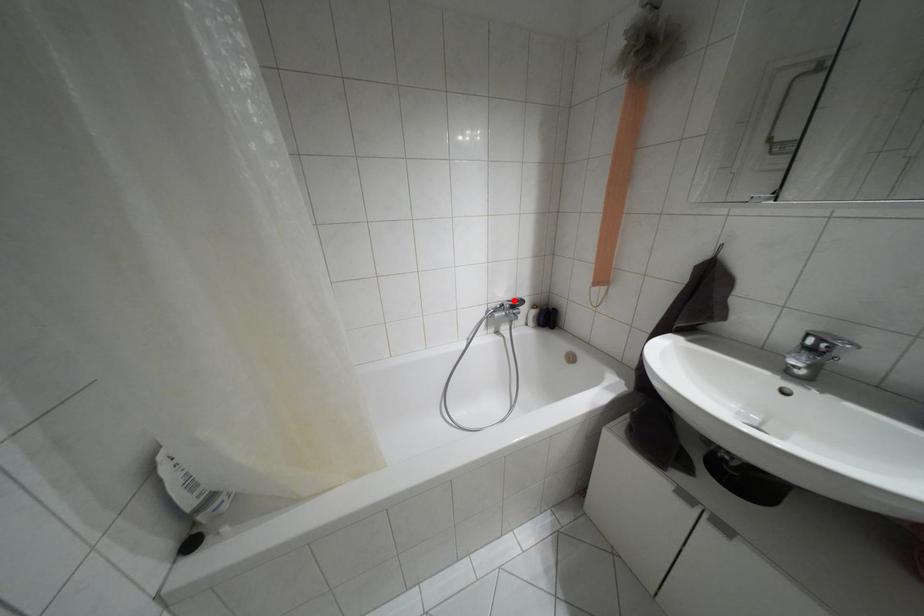
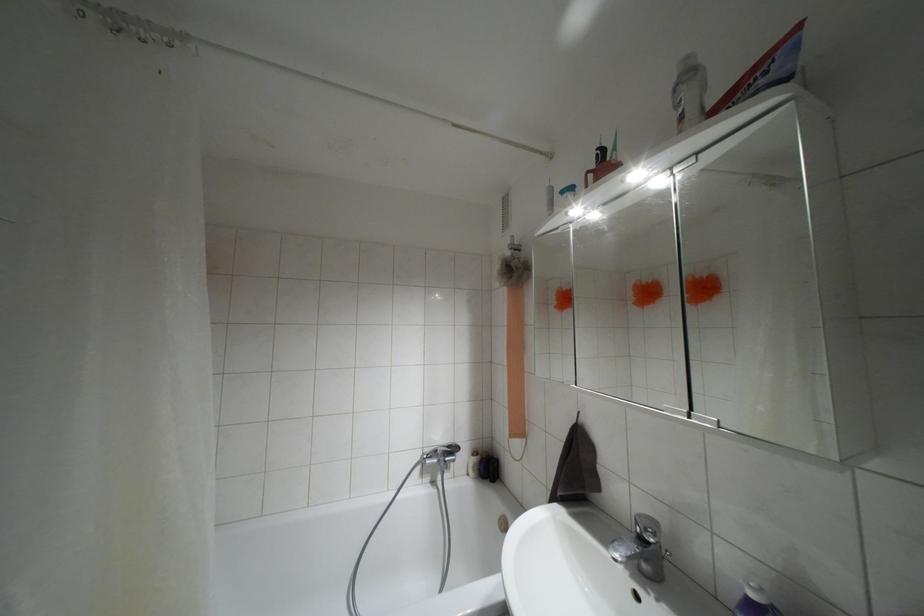
Question: I am providing you with two images of the same scene from different viewpoints. A red point is shown in image1. For the corresponding object point in image2, is it positioned nearer or farther from the camera?

Choices:
 (A) Nearer
 (B) Farther

Answer: (B)